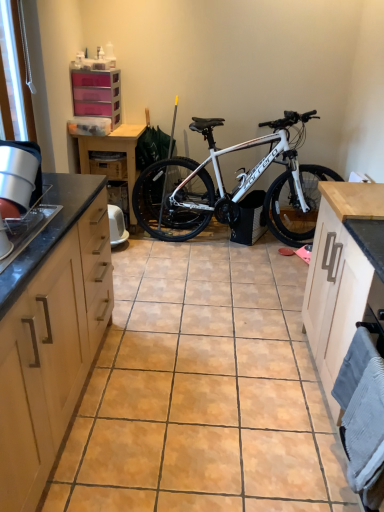
Question: Can you confirm if wooden drawer at center is smaller than white metallic bicycle at center?

Choices:
 (A) yes
 (B) no

Answer: (A)

Question: Are wooden drawer at center and white metallic bicycle at center located far from each other?

Choices:
 (A) yes
 (B) no

Answer: (B)

Question: Is wooden drawer at center positioned in front of white metallic bicycle at center?

Choices:
 (A) yes
 (B) no

Answer: (B)

Question: Does wooden drawer at center come behind white metallic bicycle at center?

Choices:
 (A) no
 (B) yes

Answer: (B)

Question: From the image's perspective, is wooden drawer at center above white metallic bicycle at center?

Choices:
 (A) yes
 (B) no

Answer: (A)

Question: Could you tell me if wooden drawer at center is turned towards white metallic bicycle at center?

Choices:
 (A) yes
 (B) no

Answer: (B)

Question: Is wooden table at center at the back of pink plastic drawers at upper left, the 1th cabinetry from the back?

Choices:
 (A) no
 (B) yes

Answer: (A)

Question: Can you confirm if pink plastic drawers at upper left, the 3th cabinetry in the right-to-left sequence, is taller than wooden table at center?

Choices:
 (A) yes
 (B) no

Answer: (B)

Question: Can you confirm if pink plastic drawers at upper left, the 1th cabinetry from the back, is bigger than wooden table at center?

Choices:
 (A) yes
 (B) no

Answer: (B)

Question: Is pink plastic drawers at upper left, the 3th cabinetry in the right-to-left sequence, positioned beyond the bounds of wooden table at center?

Choices:
 (A) no
 (B) yes

Answer: (B)

Question: From the image's perspective, would you say pink plastic drawers at upper left, the 3th cabinetry in the right-to-left sequence, is shown under wooden table at center?

Choices:
 (A) yes
 (B) no

Answer: (B)

Question: Is pink plastic drawers at upper left, placed as the first cabinetry when sorted from left to right, facing towards wooden table at center?

Choices:
 (A) yes
 (B) no

Answer: (B)

Question: From the image's perspective, does light wood cabinet at right, which is the second cabinetry from back to front, appear lower than wooden drawer at center?

Choices:
 (A) no
 (B) yes

Answer: (B)